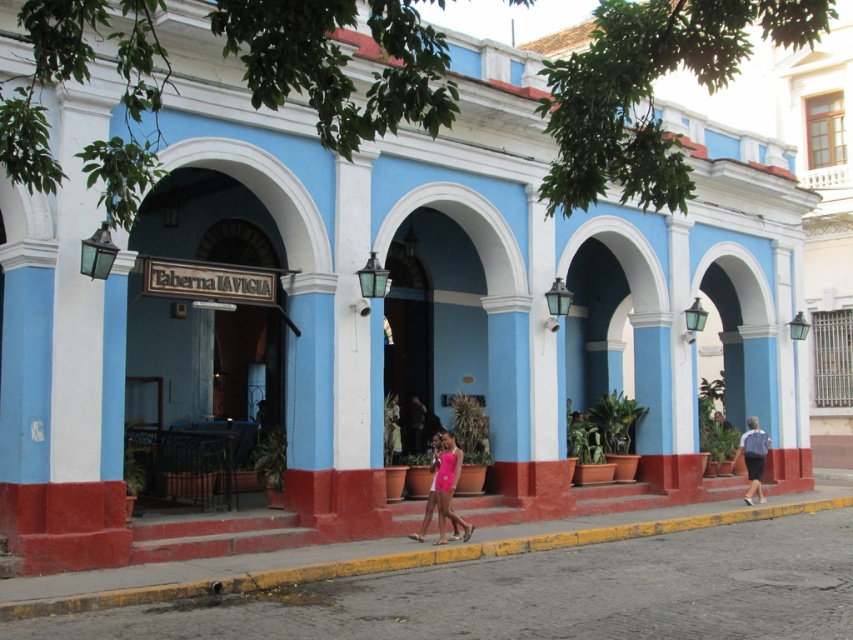
You are standing in front of the colonial building and notice the yellow asphalt at lower center and the light blue shirt at center. Which object is positioned lower in the scene?

The yellow asphalt at lower center is positioned lower than the light blue shirt at center.

You are a fashion designer observing the colonial building scene. You notice a pink matte dress at center and a light blue shirt at center. Which clothing item occupies more horizontal space in the image?

The pink matte dress at center might be wider than the light blue shirt at center, so it likely occupies more horizontal space in the image.